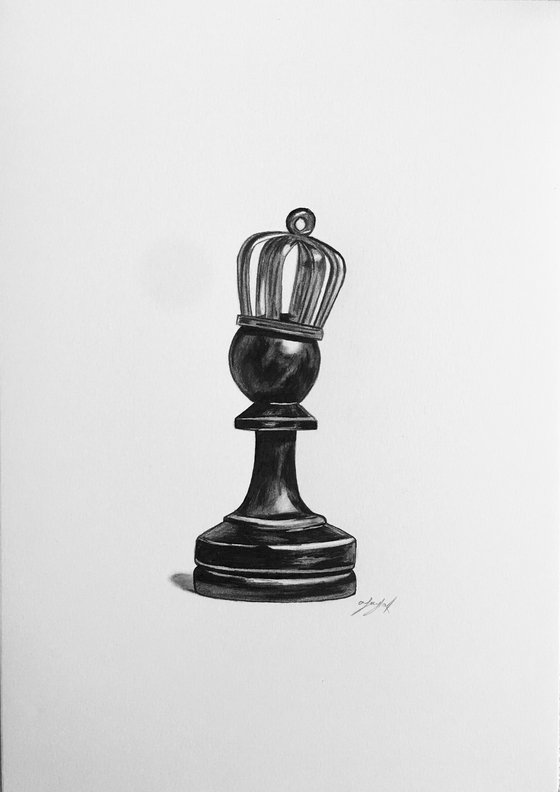
Identify the location of looks like a blender attachment. The height and width of the screenshot is (792, 560). (270, 272).